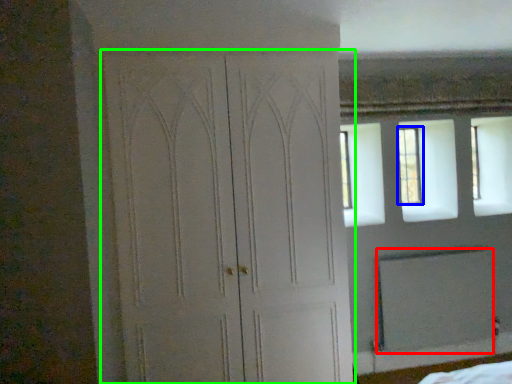
Question: Based on their relative distances, which object is farther from screen door (highlighted by a red box)? Choose from window (highlighted by a blue box) and door (highlighted by a green box).

Choices:
 (A) window
 (B) door

Answer: (B)